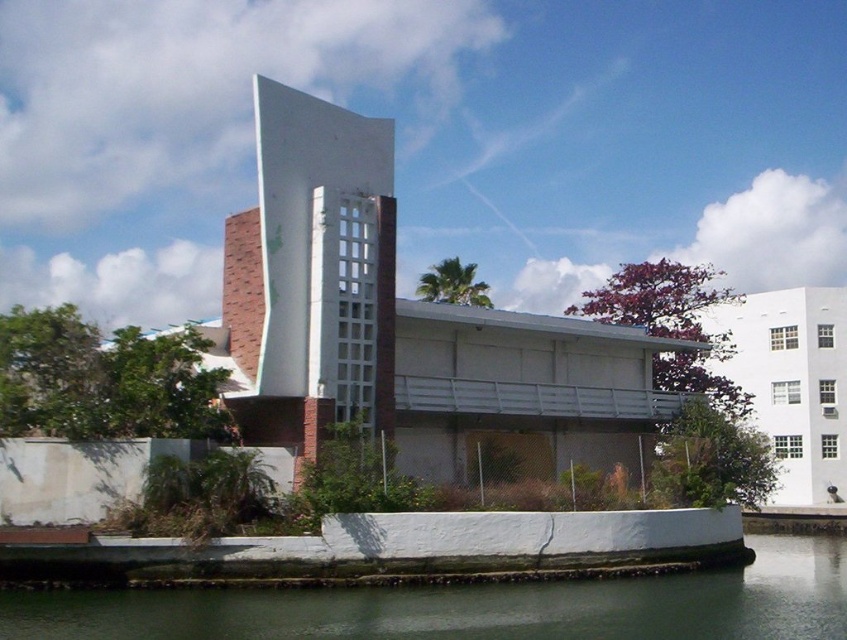
You are a drone operator planning to fly a drone between the white glass tower at center and the greenish water at lower center. What should you consider regarding their widths?

The white glass tower at center is narrower than the greenish water at lower center, so the drone should be aware of the narrower space around the tower compared to the water.

You are a visitor standing in front of the modern architectural structure. You notice the white glass tower at center and the greenish water at lower center. Which object is closer to you from your current position?

The white glass tower at center is closer to you because the greenish water at lower center is positioned behind it.